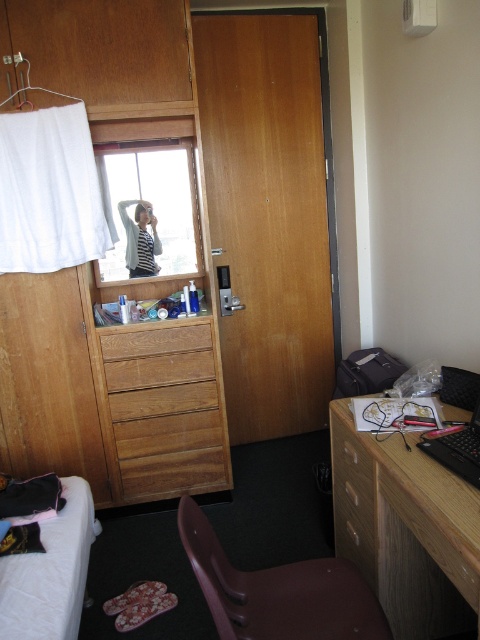
Question: Which object is closer to the camera taking this photo?

Choices:
 (A) brown wooden drawer at center
 (B) wooden dresser at center
 (C) wooden drawer at lower center

Answer: (C)

Question: Can you confirm if transparent glass window at upper center is positioned above white quilted bed at lower left?

Choices:
 (A) no
 (B) yes

Answer: (B)

Question: Considering the relative positions of wooden dresser at center and transparent glass window at upper center in the image provided, where is wooden dresser at center located with respect to transparent glass window at upper center?

Choices:
 (A) left
 (B) right

Answer: (B)

Question: Which point is closer to the camera?

Choices:
 (A) striped shirt at upper left
 (B) white quilted bed at lower left
 (C) wooden desk at lower right

Answer: (C)

Question: Does transparent glass window at upper center appear over striped shirt at upper left?

Choices:
 (A) yes
 (B) no

Answer: (A)

Question: Which point appears closest to the camera in this image?

Choices:
 (A) (92, 230)
 (B) (149, 218)
 (C) (363, 518)
 (D) (189, 186)

Answer: (C)